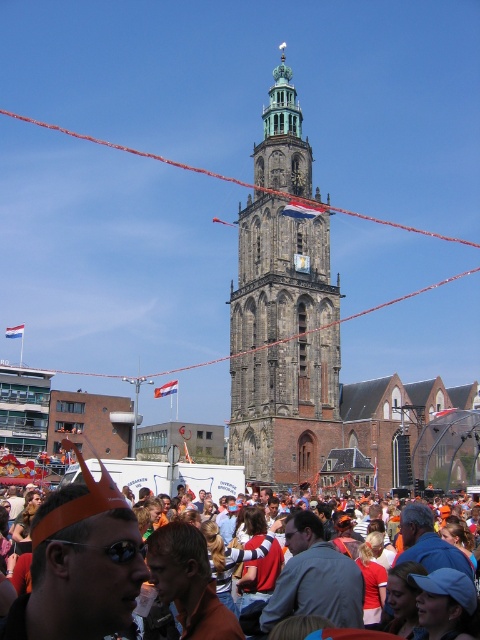
Can you confirm if stone brick bell tower at center is positioned above stone tower at center?

Incorrect, stone brick bell tower at center is not positioned above stone tower at center.

Between stone brick bell tower at center and stone tower at center, which one appears on the left side from the viewer's perspective?

stone tower at center is more to the left.

This screenshot has height=640, width=480. What do you see at coordinates (283, 310) in the screenshot? I see `stone brick bell tower at center` at bounding box center [283, 310].

Find the location of a particular element. Image resolution: width=480 pixels, height=640 pixels. stone brick bell tower at center is located at coordinates (283, 310).

Does orange fabric crowd at lower center come behind stone tower at center?

No.

Who is taller, orange fabric crowd at lower center or stone tower at center?

With more height is stone tower at center.

Which is behind, point (67, 493) or point (466, 241)?

The point (466, 241) is more distant.

The width and height of the screenshot is (480, 640). In order to click on orange fabric crowd at lower center in this screenshot , I will do `click(81, 566)`.

Does point (277, 417) come farther from viewer compared to point (47, 548)?

That is True.

Who is positioned more to the left, stone brick bell tower at center or orange fabric crowd at lower center?

From the viewer's perspective, orange fabric crowd at lower center appears more on the left side.

Find the location of a particular element. The width and height of the screenshot is (480, 640). stone brick bell tower at center is located at coordinates (283, 310).